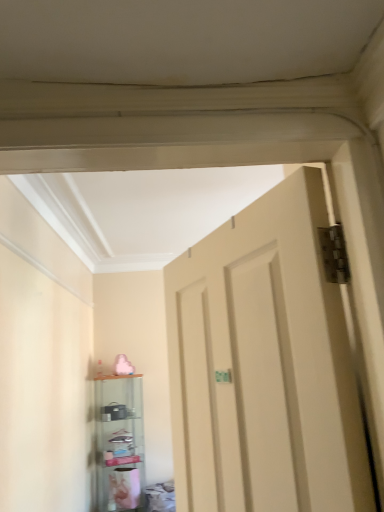
Identify the location of matte beige door at center. The image size is (384, 512). (264, 365).

This screenshot has width=384, height=512. Describe the element at coordinates (264, 365) in the screenshot. I see `matte beige door at center` at that location.

Measure the distance between matte beige door at center and camera.

The distance of matte beige door at center from camera is 25.54 inches.

Describe the element at coordinates (117, 443) in the screenshot. I see `transparent glass shelf at lower left` at that location.

Where is `transparent glass shelf at lower left`? transparent glass shelf at lower left is located at coordinates click(117, 443).

Identify the location of matte beige door at center. (264, 365).

In the image, is matte beige door at center on the left side or the right side of transparent glass shelf at lower left?

From the image, it's evident that matte beige door at center is to the right of transparent glass shelf at lower left.

Which object is further away from the camera taking this photo, matte beige door at center or transparent glass shelf at lower left?

transparent glass shelf at lower left is behind.

Considering the positions of points (287, 420) and (140, 391), is point (287, 420) farther from camera compared to point (140, 391)?

No, (287, 420) is in front of (140, 391).

From the image's perspective, who appears lower, matte beige door at center or transparent glass shelf at lower left?

From the image's view, transparent glass shelf at lower left is below.

From a real-world perspective, is matte beige door at center located higher than transparent glass shelf at lower left?

Yes, from a real-world perspective, matte beige door at center is over transparent glass shelf at lower left

Does matte beige door at center have a lesser width compared to transparent glass shelf at lower left?

Correct, the width of matte beige door at center is less than that of transparent glass shelf at lower left.

Is matte beige door at center taller than transparent glass shelf at lower left?

Incorrect, the height of matte beige door at center is not larger of that of transparent glass shelf at lower left.

Who is smaller, matte beige door at center or transparent glass shelf at lower left?

matte beige door at center.

Is matte beige door at center positioned beyond the bounds of transparent glass shelf at lower left?

Indeed, matte beige door at center is completely outside transparent glass shelf at lower left.

Would you consider matte beige door at center to be distant from transparent glass shelf at lower left?

Yes, matte beige door at center is far from transparent glass shelf at lower left.

Is transparent glass shelf at lower left at the back of matte beige door at center?

No, matte beige door at center is not facing away from transparent glass shelf at lower left.

Looking at this image, can you tell me how much matte beige door at center and transparent glass shelf at lower left differ in facing direction?

There is a 84.5-degree angle between the facing directions of matte beige door at center and transparent glass shelf at lower left.

At what (x,y) coordinates should I click in order to perform the action: click on shelf that is behind the matte beige door at center. Please return your answer as a coordinate pair (x, y). Looking at the image, I should click on (117, 443).

Which is more to the left, transparent glass shelf at lower left or matte beige door at center?

From the viewer's perspective, transparent glass shelf at lower left appears more on the left side.

Consider the image. Between transparent glass shelf at lower left and matte beige door at center, which one is positioned behind?

Positioned behind is transparent glass shelf at lower left.

Between point (134, 403) and point (361, 466), which one is positioned behind?

The point (134, 403) is behind.

From the image's perspective, is transparent glass shelf at lower left on matte beige door at center?

Incorrect, from the image's perspective, transparent glass shelf at lower left is lower than matte beige door at center.

From a real-world perspective, is transparent glass shelf at lower left on matte beige door at center?

Incorrect, from a real-world perspective, transparent glass shelf at lower left is lower than matte beige door at center.

From the picture: In terms of width, does transparent glass shelf at lower left look wider or thinner when compared to matte beige door at center?

transparent glass shelf at lower left is wider than matte beige door at center.

Considering the relative sizes of transparent glass shelf at lower left and matte beige door at center in the image provided, is transparent glass shelf at lower left shorter than matte beige door at center?

Incorrect, the height of transparent glass shelf at lower left does not fall short of that of matte beige door at center.

Considering the relative sizes of transparent glass shelf at lower left and matte beige door at center in the image provided, is transparent glass shelf at lower left smaller than matte beige door at center?

No, transparent glass shelf at lower left is not smaller than matte beige door at center.

Does transparent glass shelf at lower left contain matte beige door at center?

No, matte beige door at center is located outside of transparent glass shelf at lower left.

Is transparent glass shelf at lower left far from matte beige door at center?

transparent glass shelf at lower left is far away from matte beige door at center.

Is transparent glass shelf at lower left oriented towards matte beige door at center?

Yes.

In the scene shown: What's the angular difference between transparent glass shelf at lower left and matte beige door at center's facing directions?

The angular difference between transparent glass shelf at lower left and matte beige door at center is 84.5 degrees.

You are a GUI agent. You are given a task and a screenshot of the screen. Output one action in this format:
    pyautogui.click(x=<x>, y=<y>)
    Task: Click on the shelf lying below the matte beige door at center (from the image's perspective)
    
    Given the screenshot: What is the action you would take?
    pyautogui.click(x=117, y=443)

Locate an element on the screen. door on the right of transparent glass shelf at lower left is located at coordinates 264,365.

I want to click on door above the transparent glass shelf at lower left (from the image's perspective), so click(x=264, y=365).